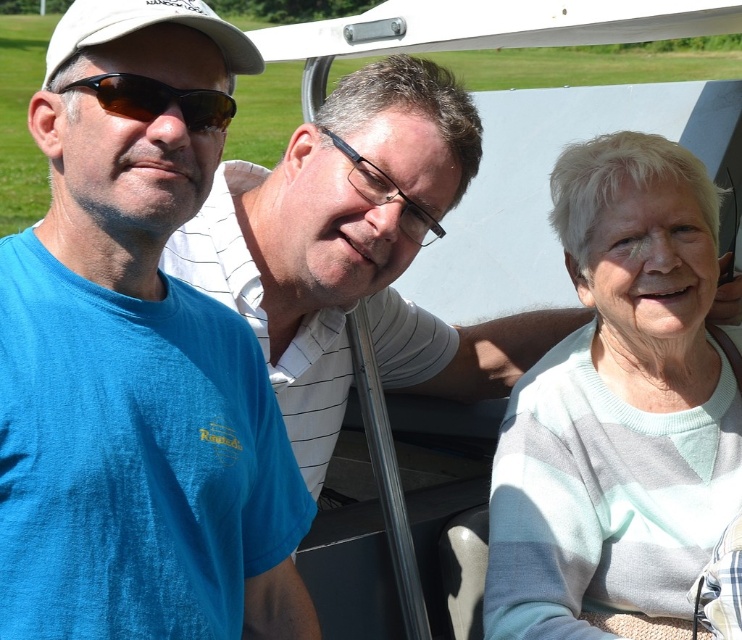
Question: Observing the image, what is the correct spatial positioning of white fabric baseball cap at upper left in reference to brown reflective sunglasses at left?

Choices:
 (A) right
 (B) left

Answer: (B)

Question: Which is nearer to the brown reflective sunglasses at left?

Choices:
 (A) white fabric baseball cap at upper left
 (B) blue cotton t-shirt at left
 (C) black plastic glasses at center

Answer: (A)

Question: Which object is positioned farthest from the white knit sweater at right?

Choices:
 (A) white fabric baseball cap at upper left
 (B) black plastic glasses at center
 (C) brown reflective sunglasses at left
 (D) blue cotton t-shirt at left

Answer: (A)

Question: Is white fabric baseball cap at upper left bigger than black plastic glasses at center?

Choices:
 (A) yes
 (B) no

Answer: (A)

Question: Which of the following is the farthest from the observer?

Choices:
 (A) blue cotton t-shirt at left
 (B) black plastic glasses at center
 (C) white fabric baseball cap at upper left
 (D) brown reflective sunglasses at left

Answer: (B)

Question: Is blue cotton t-shirt at left bigger than brown reflective sunglasses at left?

Choices:
 (A) yes
 (B) no

Answer: (A)